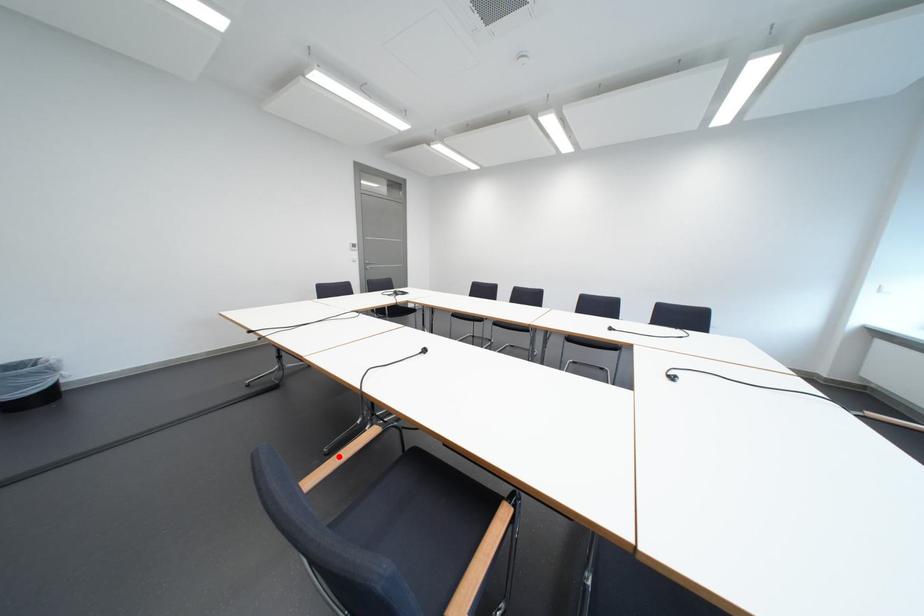
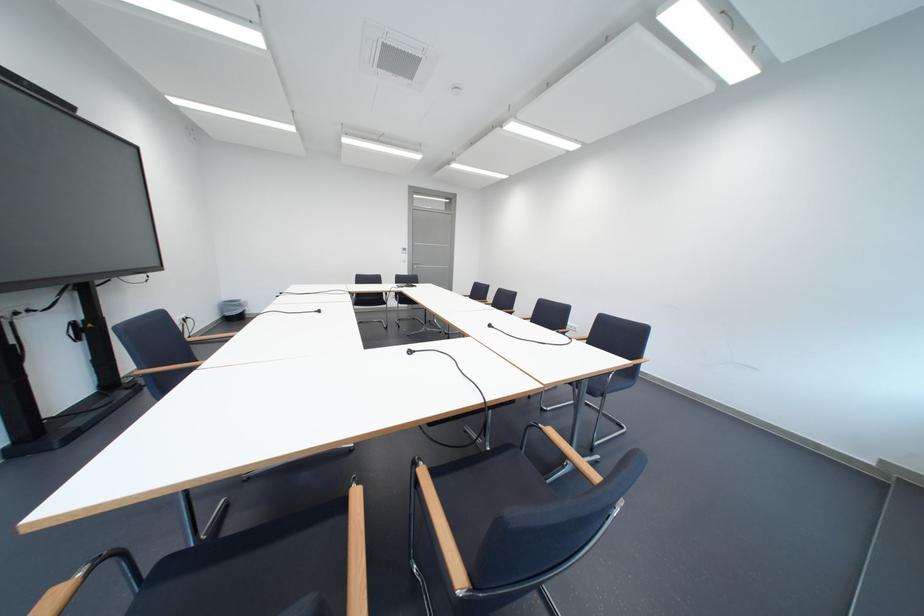
Question: I am providing you with two images of the same scene from different viewpoints. A red point is marked on the first image. Is the red point's position out of view in image 2?

Choices:
 (A) Yes
 (B) No

Answer: (A)